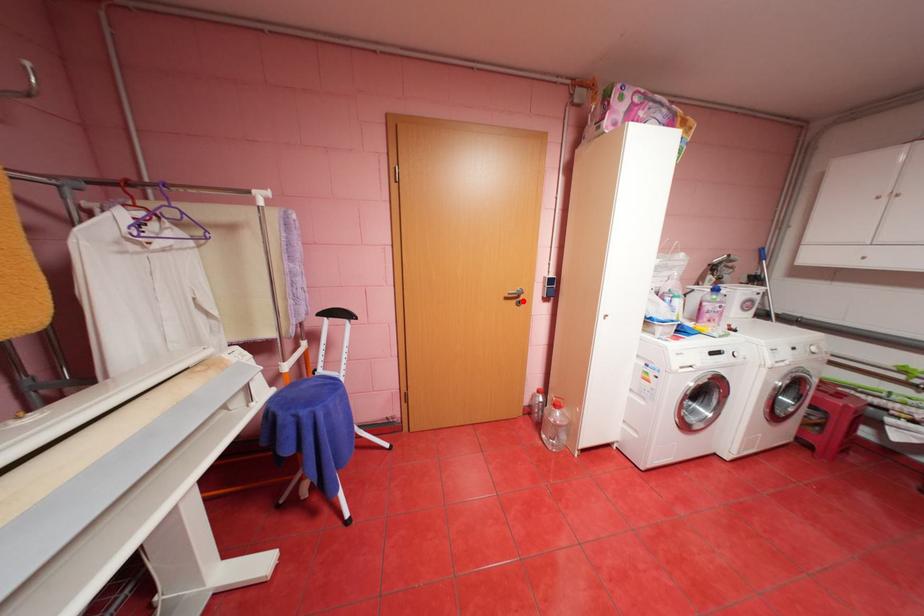
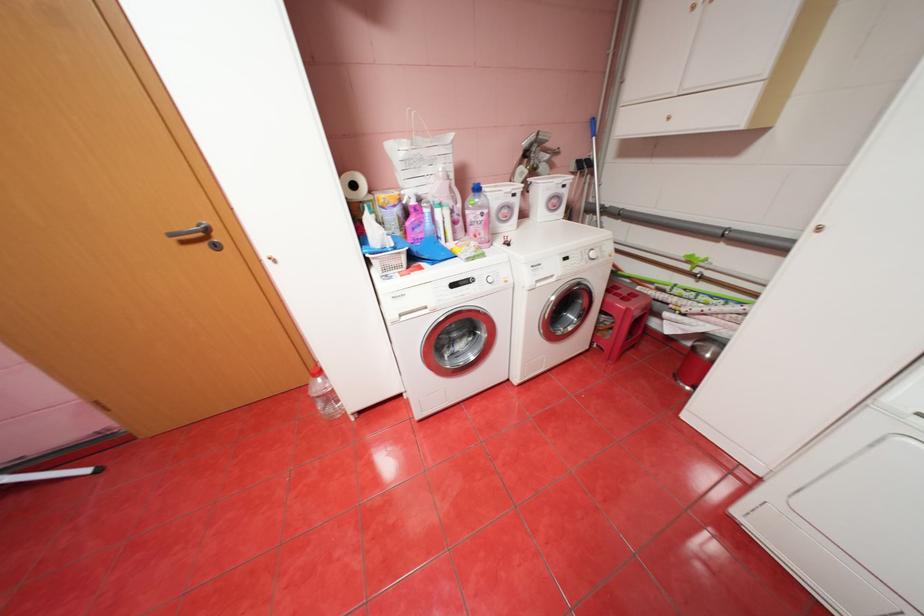
The point at the highlighted location is marked in the first image. Where is the corresponding point in the second image?

(213, 245)